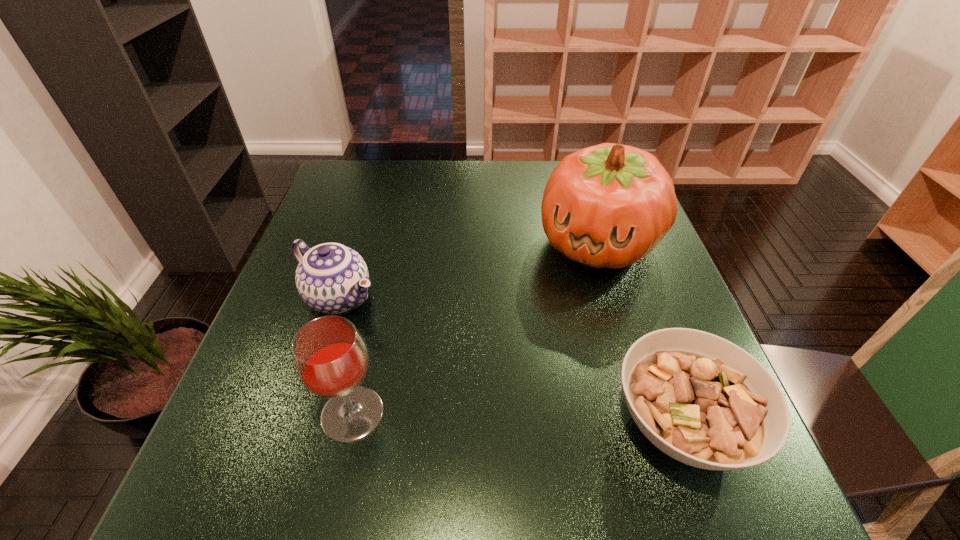
Identify the location of free region at the near left corner of the desktop. The height and width of the screenshot is (540, 960). (304, 440).

The height and width of the screenshot is (540, 960). I want to click on vacant region between the stew and the pumpkin, so click(639, 333).

You are a GUI agent. You are given a task and a screenshot of the screen. Output one action in this format:
    pyautogui.click(x=<x>, y=<y>)
    Task: Click on the vacant space that is in between the stew and the third tallest object
    
    Given the screenshot: What is the action you would take?
    pyautogui.click(x=510, y=360)

Identify the location of empty location between the shortest object and the pumpkin. (639, 333).

Where is `free space between the shortest object and the wineglass`? Image resolution: width=960 pixels, height=540 pixels. free space between the shortest object and the wineglass is located at coordinates (516, 418).

Locate an element on the screen. This screenshot has height=540, width=960. vacant space in between the wineglass and the pumpkin is located at coordinates (475, 328).

Find the location of a particular element. unoccupied area between the tallest object and the shortest object is located at coordinates (639, 333).

Where is `free space between the shortest object and the chinaware`? The width and height of the screenshot is (960, 540). free space between the shortest object and the chinaware is located at coordinates (510, 360).

This screenshot has height=540, width=960. I want to click on blank region between the tallest object and the second shortest object, so click(468, 270).

At what (x,y) coordinates should I click in order to perform the action: click on free space between the chinaware and the shortest object. Please return your answer as a coordinate pair (x, y). The width and height of the screenshot is (960, 540). Looking at the image, I should click on (510, 360).